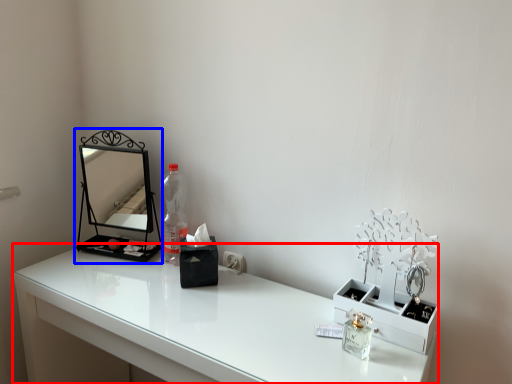
Question: Which of the following is the farthest to the observer, table (highlighted by a red box) or medicine cabinet (highlighted by a blue box)?

Choices:
 (A) table
 (B) medicine cabinet

Answer: (B)